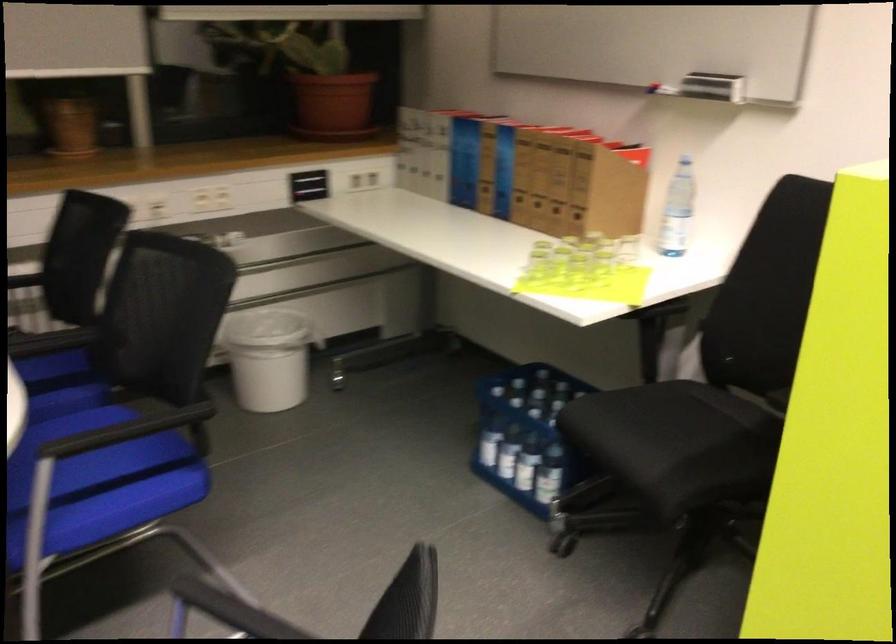
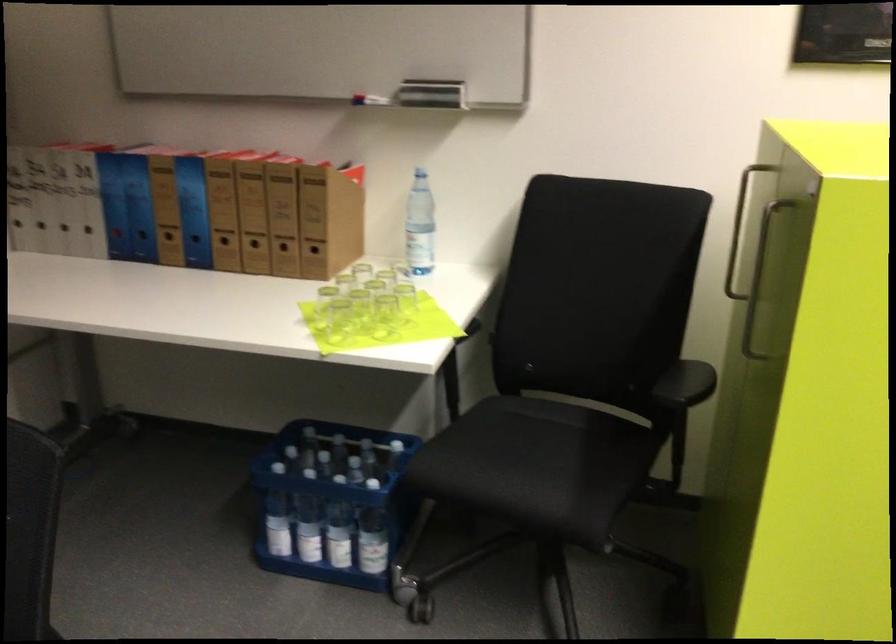
Find the pixel in the second image that matches point (591, 278) in the first image.

(383, 316)